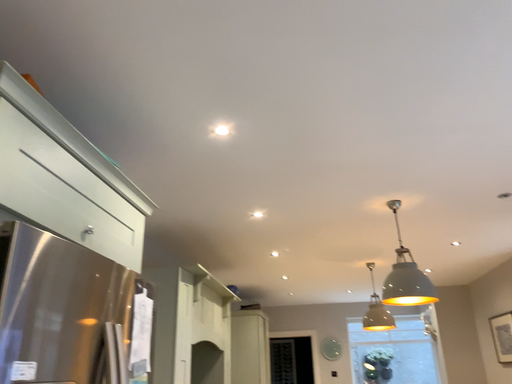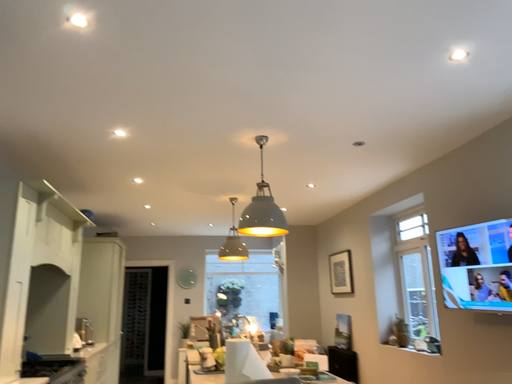
Question: Which way did the camera rotate in the video?

Choices:
 (A) rotated downward
 (B) rotated upward

Answer: (A)